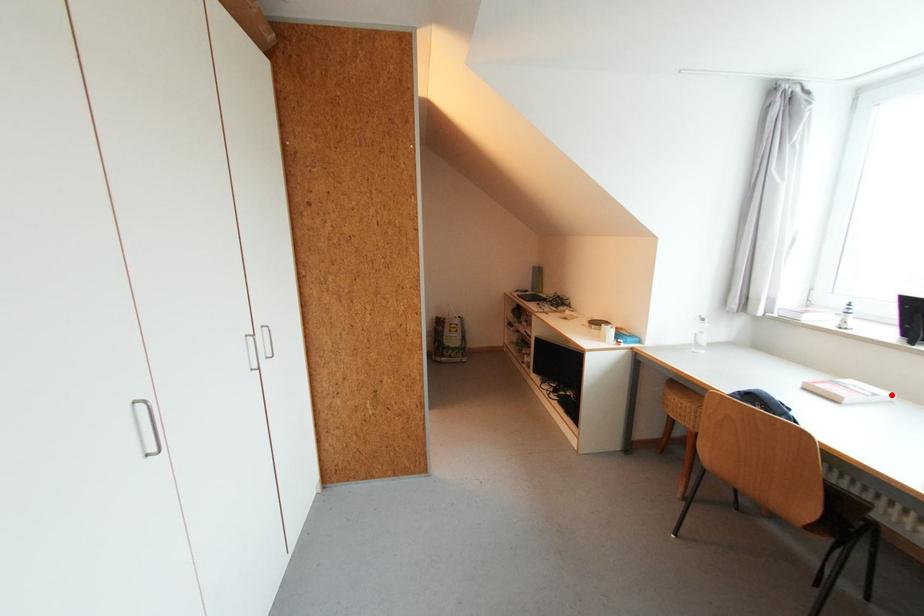
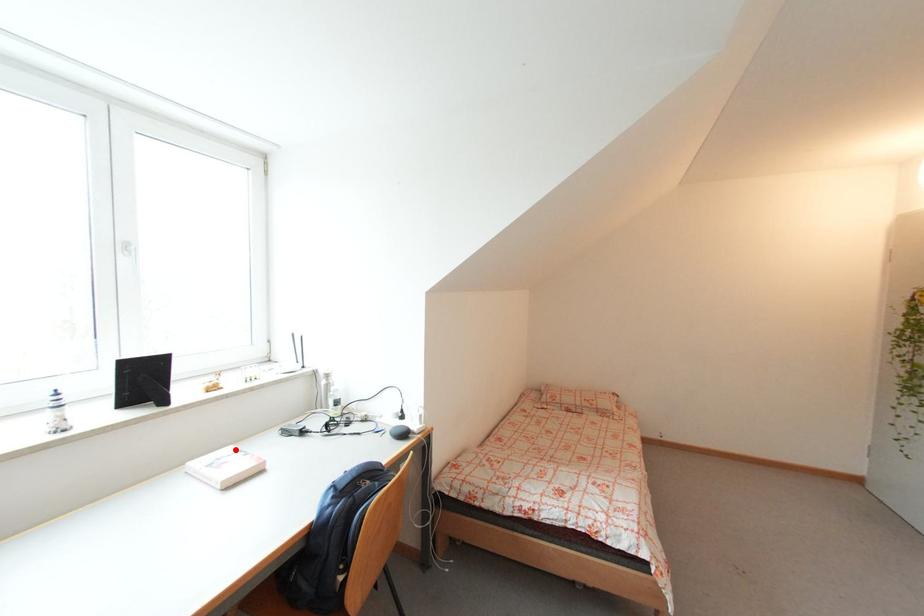
I am providing you with two images of the same scene from different viewpoints. A red point is marked on the first image and another point is marked on the second image. Is the red point in image1 aligned with the point shown in image2?

Yes